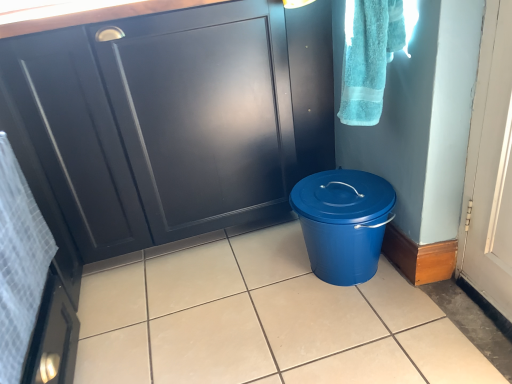
Question: Is matte black cabinet at center oriented away from matte blue bucket at center?

Choices:
 (A) no
 (B) yes

Answer: (A)

Question: Does matte black cabinet at center have a lesser width compared to matte blue bucket at center?

Choices:
 (A) yes
 (B) no

Answer: (A)

Question: Does matte black cabinet at center have a smaller size compared to matte blue bucket at center?

Choices:
 (A) yes
 (B) no

Answer: (B)

Question: Is matte black cabinet at center taller than matte blue bucket at center?

Choices:
 (A) yes
 (B) no

Answer: (A)

Question: Is matte black cabinet at center behind matte blue bucket at center?

Choices:
 (A) yes
 (B) no

Answer: (A)

Question: Is white textured towel at left, which is counted as the 2th bath towel, starting from the right, inside the boundaries of blue plastic bucket at lower right, or outside?

Choices:
 (A) inside
 (B) outside

Answer: (B)

Question: Relative to blue plastic bucket at lower right, is white textured towel at left, which is counted as the 2th bath towel, starting from the right, in front or behind?

Choices:
 (A) front
 (B) behind

Answer: (A)

Question: From the image's perspective, relative to blue plastic bucket at lower right, is white textured towel at left, marked as the 1th bath towel in a left-to-right arrangement, above or below?

Choices:
 (A) below
 (B) above

Answer: (A)

Question: Based on their sizes in the image, would you say white textured towel at left, the 1th bath towel in the bottom-to-top sequence, is bigger or smaller than blue plastic bucket at lower right?

Choices:
 (A) small
 (B) big

Answer: (B)

Question: Would you say matte blue bucket at center is to the left or to the right of turquoise cotton towel at upper right, marked as the 1th bath towel in a top-to-bottom arrangement, in the picture?

Choices:
 (A) left
 (B) right

Answer: (A)

Question: From a real-world perspective, is matte blue bucket at center physically located above or below turquoise cotton towel at upper right, the first bath towel when ordered from right to left?

Choices:
 (A) above
 (B) below

Answer: (B)

Question: In the image, is matte blue bucket at center positioned in front of or behind turquoise cotton towel at upper right, marked as the 1th bath towel in a top-to-bottom arrangement?

Choices:
 (A) front
 (B) behind

Answer: (A)

Question: Considering the positions of matte blue bucket at center and turquoise cotton towel at upper right, positioned as the 2th bath towel in left-to-right order, in the image, is matte blue bucket at center wider or thinner than turquoise cotton towel at upper right, positioned as the 2th bath towel in left-to-right order,?

Choices:
 (A) wide
 (B) thin

Answer: (A)

Question: From the image's perspective, is turquoise cotton towel at upper right, the second bath towel in the bottom-to-top sequence, located above or below matte black cabinet at center?

Choices:
 (A) below
 (B) above

Answer: (B)

Question: Is turquoise cotton towel at upper right, the second bath towel in the bottom-to-top sequence, wider or thinner than matte black cabinet at center?

Choices:
 (A) thin
 (B) wide

Answer: (A)